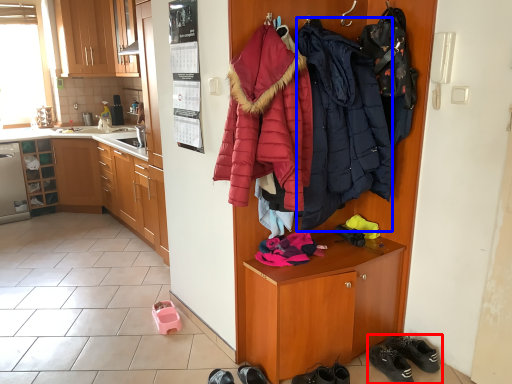
Question: Which object is further to the camera taking this photo, footwear (highlighted by a red box) or jacket (highlighted by a blue box)?

Choices:
 (A) footwear
 (B) jacket

Answer: (A)